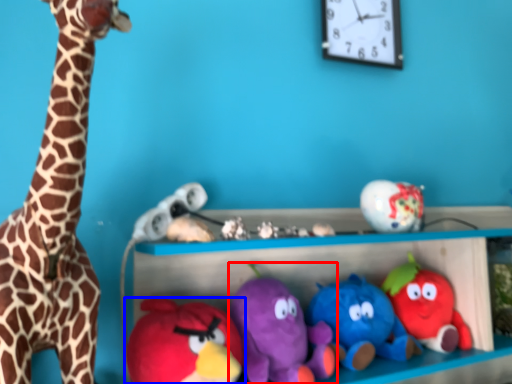
Question: Among these objects, which one is farthest to the camera, toy (highlighted by a red box) or toy (highlighted by a blue box)?

Choices:
 (A) toy
 (B) toy

Answer: (A)